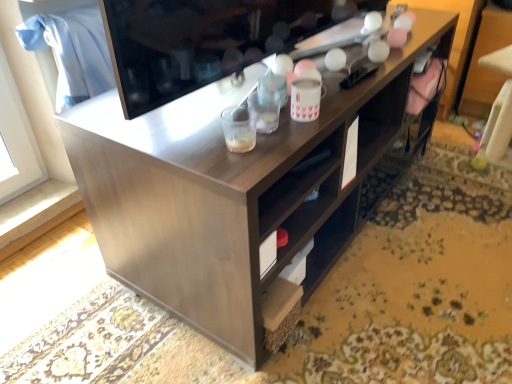
Question: In the image, is translucent plastic cup at center, the second beverage when ordered from back to front, positioned in front of or behind matte black television at upper center?

Choices:
 (A) front
 (B) behind

Answer: (B)

Question: Is translucent plastic cup at center, arranged as the 1th beverage when viewed from the left, bigger or smaller than matte black television at upper center?

Choices:
 (A) small
 (B) big

Answer: (A)

Question: Considering the real-world distances, which object is farthest from the translucent plastic cup at center, arranged as the 1th beverage when viewed from the left?

Choices:
 (A) white ceramic mug at upper center, the second beverage positioned from the front
 (B) matte black television at upper center

Answer: (B)

Question: Considering the real-world distances, which object is farthest from the matte black television at upper center?

Choices:
 (A) white ceramic mug at upper center, the second beverage positioned from the front
 (B) translucent plastic cup at center, which is counted as the 1th beverage, starting from the front

Answer: (A)